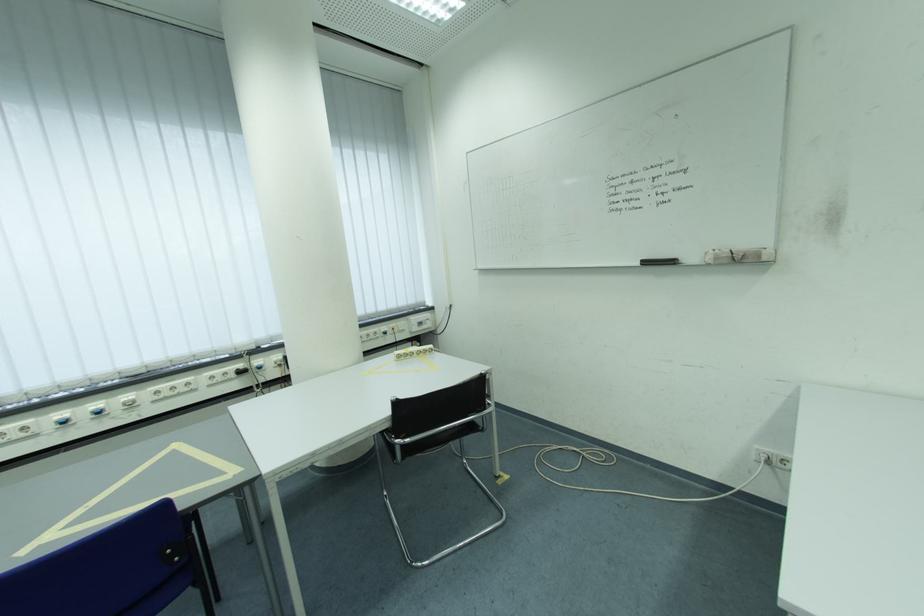
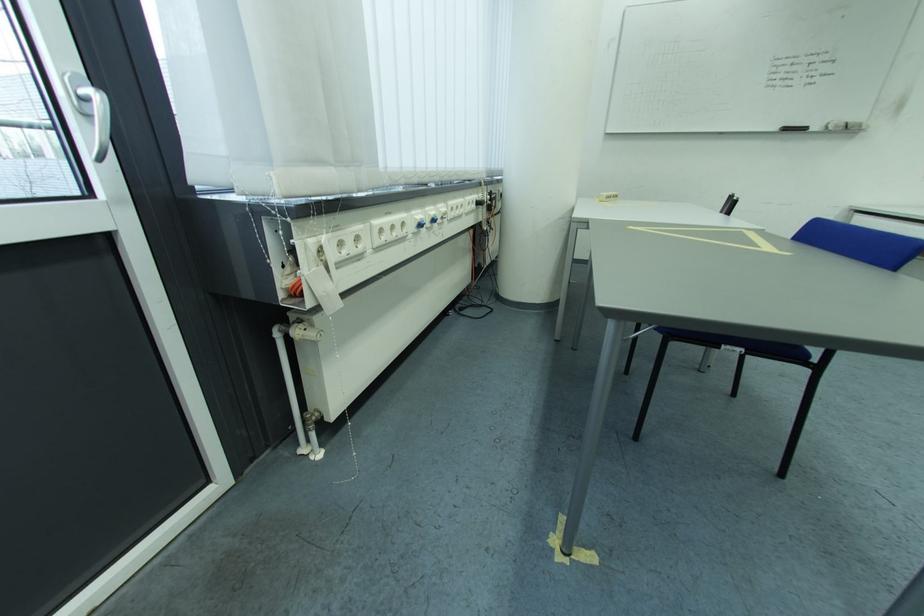
Locate, in the second image, the point that corresponds to (x=655, y=265) in the first image.

(796, 131)